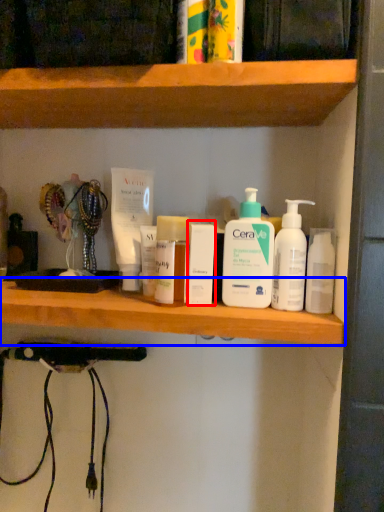
Question: Which of the following is the closest to the observer, toiletry (highlighted by a red box) or shelf (highlighted by a blue box)?

Choices:
 (A) toiletry
 (B) shelf

Answer: (B)